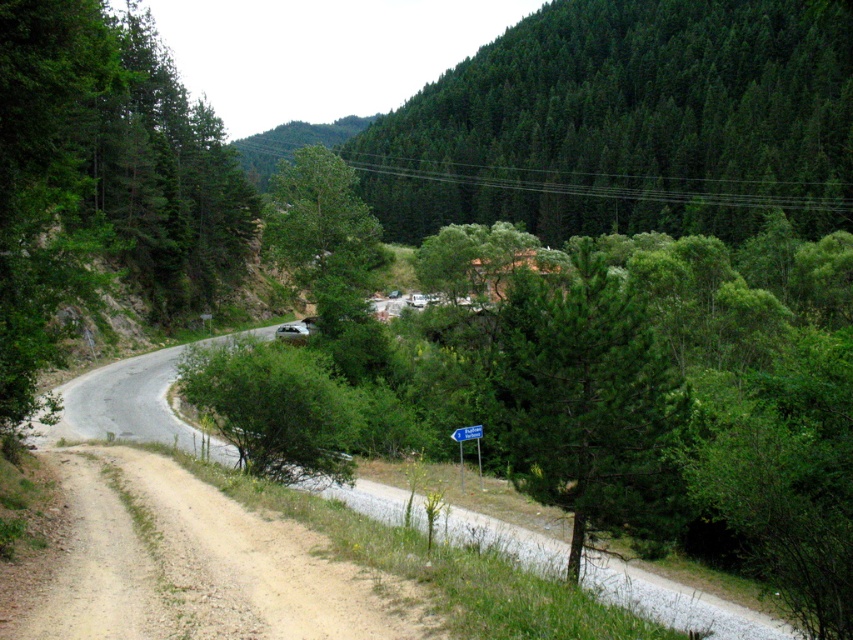
Does brown gravel dirt track at lower left have a greater height compared to blue plastic sign at center?

No.

Between point (334, 589) and point (462, 467), which one is positioned in front?

Positioned in front is point (334, 589).

Identify the location of brown gravel dirt track at lower left. (200, 564).

Describe the element at coordinates (322, 234) in the screenshot. I see `green matte tree at center` at that location.

Can you confirm if green matte tree at center is taller than blue plastic sign at center?

Indeed, green matte tree at center has a greater height compared to blue plastic sign at center.

This screenshot has height=640, width=853. Identify the location of green matte tree at center. (322, 234).

Does green leafy bush at center appear under green matte tree at center?

Correct, green leafy bush at center is located below green matte tree at center.

Between green leafy bush at center and green matte tree at center, which one appears on the left side from the viewer's perspective?

Positioned to the left is green matte tree at center.

Find the location of a particular element. This screenshot has width=853, height=640. green leafy bush at center is located at coordinates coord(273,408).